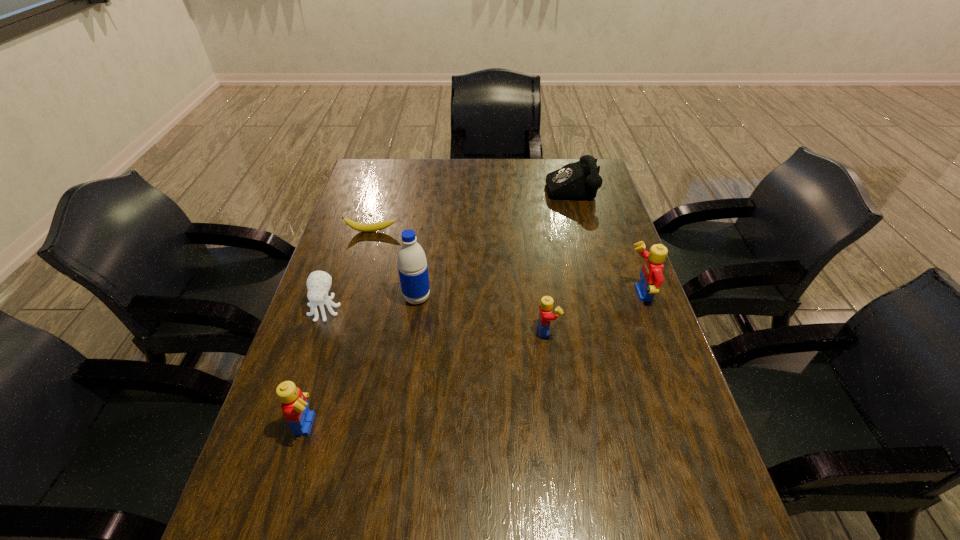
Locate an element on the screen. the nearest Lego is located at coordinates (294, 405).

Where is `the leftmost Lego`? This screenshot has height=540, width=960. the leftmost Lego is located at coordinates (294, 405).

The width and height of the screenshot is (960, 540). What are the coordinates of `the second Lego from right to left` in the screenshot? It's located at (545, 317).

Find the location of a particular element. The width and height of the screenshot is (960, 540). the third object from right to left is located at coordinates (545, 317).

Where is `the rightmost Lego`? This screenshot has width=960, height=540. the rightmost Lego is located at coordinates (651, 275).

In order to click on telephone in this screenshot , I will do `click(577, 181)`.

Image resolution: width=960 pixels, height=540 pixels. I want to click on the sixth nearest object, so click(x=362, y=227).

You are a GUI agent. You are given a task and a screenshot of the screen. Output one action in this format:
    pyautogui.click(x=<x>, y=<y>)
    Task: Click on the shortest object
    
    Given the screenshot: What is the action you would take?
    pyautogui.click(x=362, y=227)

Identify the location of the fourth object from right to left. The height and width of the screenshot is (540, 960). (412, 265).

You are a GUI agent. You are given a task and a screenshot of the screen. Output one action in this format:
    pyautogui.click(x=<x>, y=<y>)
    Task: Click on the water bottle
    The image size is (960, 540).
    Given the screenshot: What is the action you would take?
    pyautogui.click(x=412, y=265)